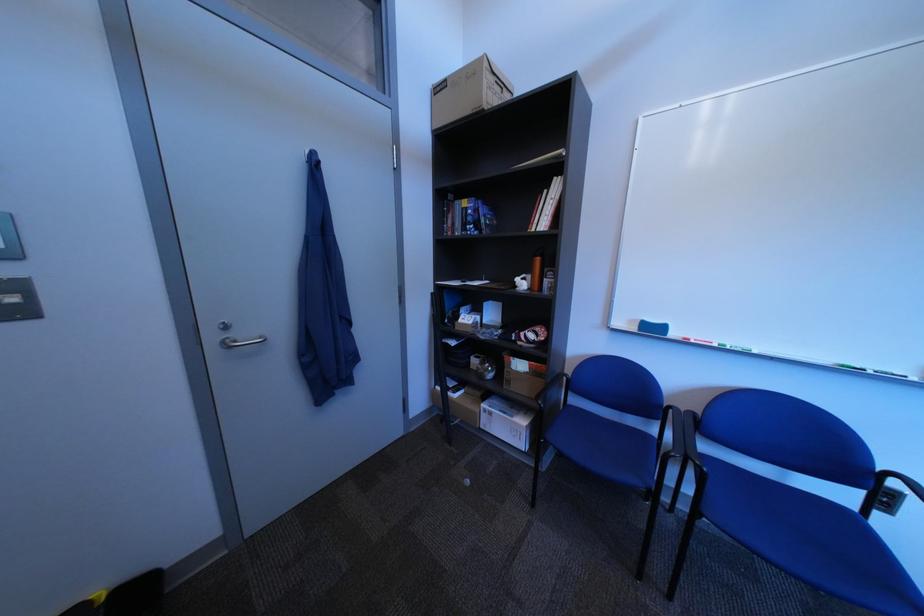
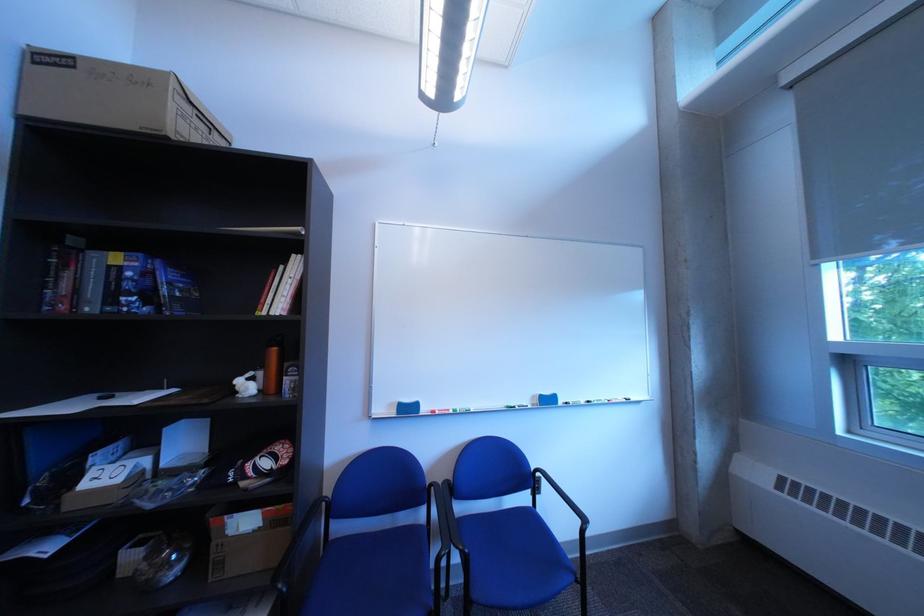
Where in the second image is the point corresponding to (530,284) from the first image?

(249, 387)